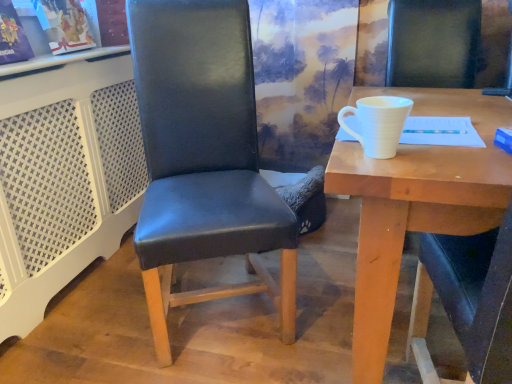
Question: Does white matte cup at upper right have a lesser height compared to white matte cup at right?

Choices:
 (A) yes
 (B) no

Answer: (B)

Question: Is white matte cup at upper right in front of white matte cup at right?

Choices:
 (A) yes
 (B) no

Answer: (A)

Question: Does white matte cup at upper right have a larger size compared to white matte cup at right?

Choices:
 (A) yes
 (B) no

Answer: (A)

Question: Is white matte cup at upper right outside white matte cup at right?

Choices:
 (A) no
 (B) yes

Answer: (B)

Question: From a real-world perspective, is white matte cup at upper right on white matte cup at right?

Choices:
 (A) no
 (B) yes

Answer: (A)

Question: Considering the positions of white matte cup at upper right and black leather chair at center in the image, is white matte cup at upper right bigger or smaller than black leather chair at center?

Choices:
 (A) small
 (B) big

Answer: (B)

Question: Is point tap(415, 107) closer or farther from the camera than point tap(251, 148)?

Choices:
 (A) closer
 (B) farther

Answer: (A)

Question: Is white matte cup at upper right inside the boundaries of black leather chair at center, or outside?

Choices:
 (A) inside
 (B) outside

Answer: (B)

Question: From the image's perspective, is white matte cup at upper right positioned above or below black leather chair at center?

Choices:
 (A) above
 (B) below

Answer: (B)

Question: From a real-world perspective, is white matte cup at right physically located above or below white matte cup at upper right?

Choices:
 (A) below
 (B) above

Answer: (B)

Question: From the image's perspective, is white matte cup at right above or below white matte cup at upper right?

Choices:
 (A) below
 (B) above

Answer: (B)

Question: Visually, is white matte cup at right positioned to the left or to the right of white matte cup at upper right?

Choices:
 (A) left
 (B) right

Answer: (A)

Question: Looking at their shapes, would you say white matte cup at right is wider or thinner than white matte cup at upper right?

Choices:
 (A) thin
 (B) wide

Answer: (A)

Question: From a real-world perspective, is black leather chair at center above or below white matte cup at right?

Choices:
 (A) below
 (B) above

Answer: (A)

Question: From their relative heights in the image, would you say black leather chair at center is taller or shorter than white matte cup at right?

Choices:
 (A) short
 (B) tall

Answer: (B)